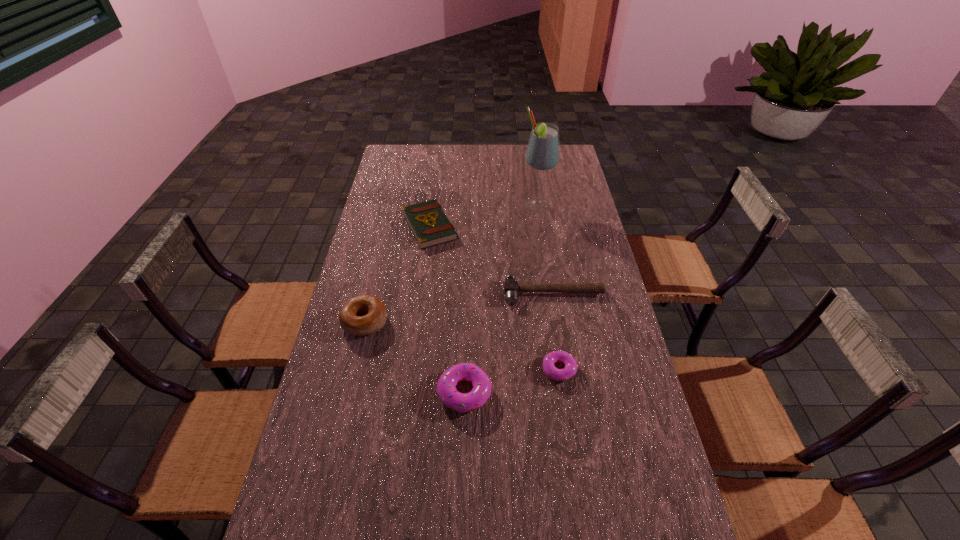
I want to click on vacant space situated on the front of the tallest object, so click(544, 252).

I want to click on free space located on the back of the fifth shortest object, so click(x=380, y=256).

At what (x,y) coordinates should I click in order to perform the action: click on free space located 0.210m on the striking face of the hammer. Please return your answer as a coordinate pair (x, y). The height and width of the screenshot is (540, 960). Looking at the image, I should click on (564, 359).

This screenshot has width=960, height=540. I want to click on book that is at the left edge, so click(428, 222).

The image size is (960, 540). Identify the location of bagel located in the left edge section of the desktop. (361, 315).

At what (x,y) coordinates should I click in order to perform the action: click on alcohol located at the right edge. Please return your answer as a coordinate pair (x, y). The image size is (960, 540). Looking at the image, I should click on (542, 154).

You are a GUI agent. You are given a task and a screenshot of the screen. Output one action in this format:
    pyautogui.click(x=<x>, y=<y>)
    Task: Click on the hammer located in the right edge section of the desktop
    The width and height of the screenshot is (960, 540).
    Given the screenshot: What is the action you would take?
    pyautogui.click(x=511, y=287)

The width and height of the screenshot is (960, 540). Find the location of `vacant space at the far edge of the desktop`. vacant space at the far edge of the desktop is located at coordinates point(468,147).

At what (x,y) coordinates should I click in order to perform the action: click on vacant region at the near edge of the desktop. Please return your answer as a coordinate pair (x, y). Looking at the image, I should click on (597, 508).

At what (x,y) coordinates should I click in order to perform the action: click on free space at the left edge. Please return your answer as a coordinate pair (x, y). Looking at the image, I should click on (365, 252).